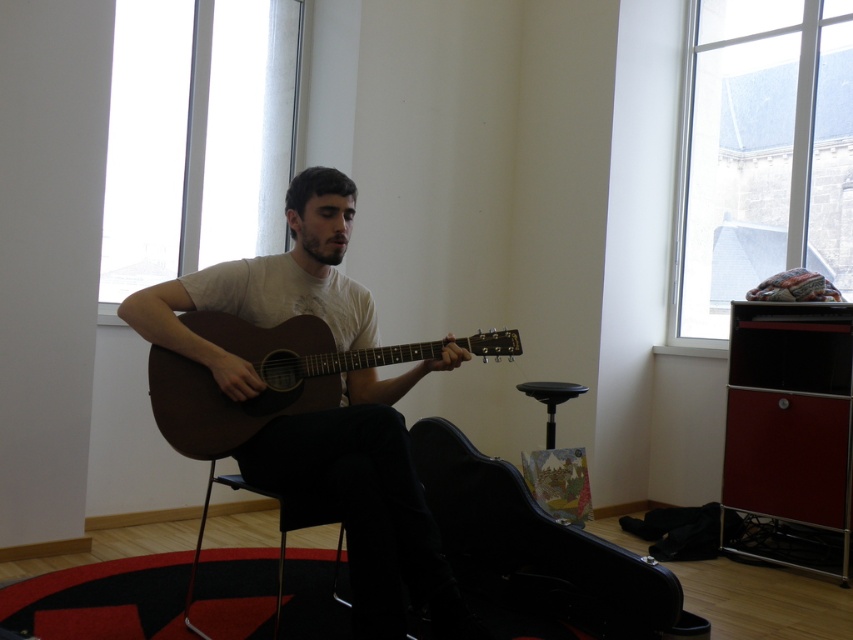
Question: Which point appears farthest from the camera in this image?

Choices:
 (A) (553, 419)
 (B) (242, 269)

Answer: (A)

Question: Can you confirm if matte brown guitar at center is wider than metallic black chair at center?

Choices:
 (A) yes
 (B) no

Answer: (A)

Question: Which of these objects is positioned closest to the matte brown guitar at center?

Choices:
 (A) metallic black chair at center
 (B) black plastic stool at center

Answer: (A)

Question: Which point is farther to the camera?

Choices:
 (A) (296, 401)
 (B) (283, 554)
 (C) (486, 531)

Answer: (C)

Question: Does black hard case at lower center lie in front of black plastic stool at center?

Choices:
 (A) yes
 (B) no

Answer: (A)

Question: Can you confirm if matte brown guitar at center is positioned to the left of black hard case at lower center?

Choices:
 (A) yes
 (B) no

Answer: (A)